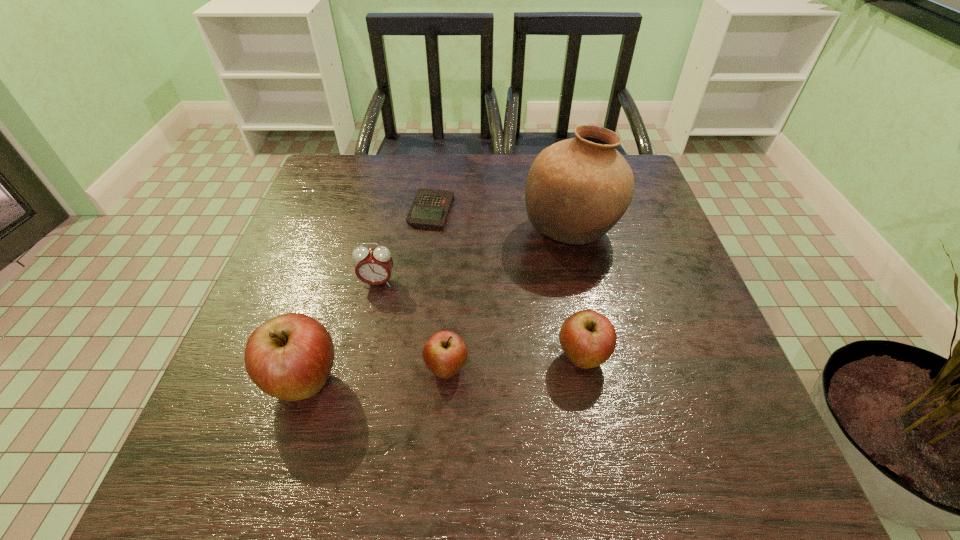
I want to click on vacant space located on the back of the calculator, so click(435, 182).

You are a GUI agent. You are given a task and a screenshot of the screen. Output one action in this format:
    pyautogui.click(x=<x>, y=<y>)
    Task: Click on the vacant space situated on the clock face of the third farthest object
    
    Given the screenshot: What is the action you would take?
    pyautogui.click(x=366, y=338)

Image resolution: width=960 pixels, height=540 pixels. Find the location of `vacant space located 0.240m on the back of the tallest object`. vacant space located 0.240m on the back of the tallest object is located at coordinates (554, 154).

This screenshot has width=960, height=540. Identify the location of calculator positioned at the far edge. (430, 208).

The image size is (960, 540). In order to click on pottery situated at the far edge in this screenshot , I will do `click(577, 189)`.

You are a GUI agent. You are given a task and a screenshot of the screen. Output one action in this format:
    pyautogui.click(x=<x>, y=<y>)
    Task: Click on the object present at the left edge
    The height and width of the screenshot is (540, 960).
    Given the screenshot: What is the action you would take?
    pyautogui.click(x=289, y=357)

Find the location of a particular element. This screenshot has height=540, width=960. object located at the right edge is located at coordinates (577, 189).

The width and height of the screenshot is (960, 540). I want to click on object at the near left corner, so click(289, 357).

This screenshot has width=960, height=540. Find the location of `object that is at the far right corner`. object that is at the far right corner is located at coordinates (577, 189).

In the image, there is a desktop. At what (x,y) coordinates should I click in order to perform the action: click on free space at the far edge. Please return your answer as a coordinate pair (x, y). The image size is (960, 540). Looking at the image, I should click on (404, 174).